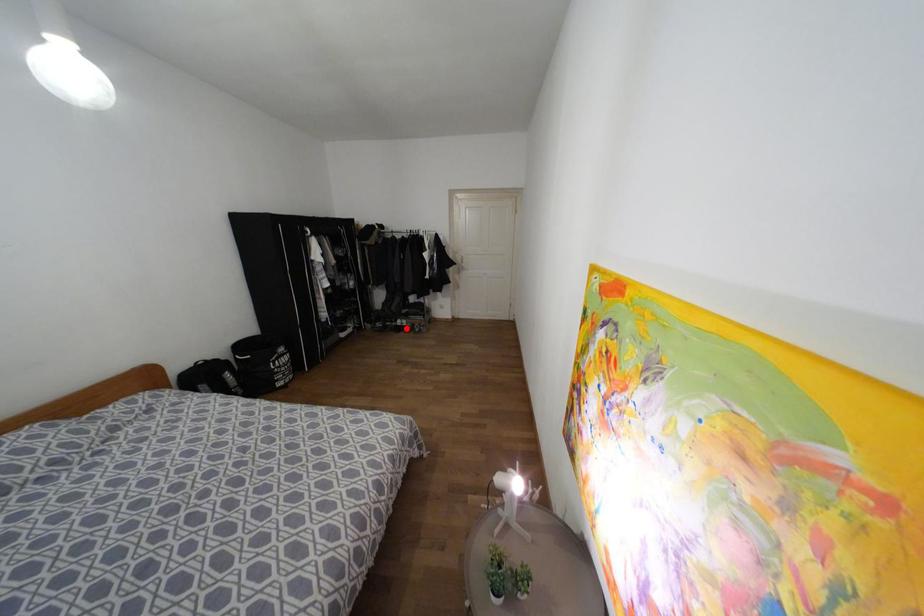
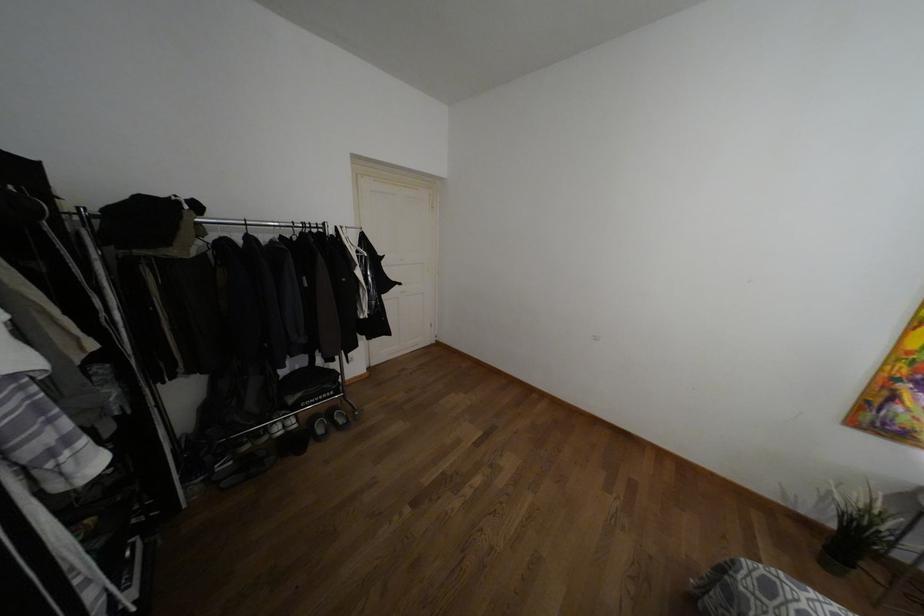
In the second image, find the point that corresponds to the highlighted location in the first image.

(320, 430)